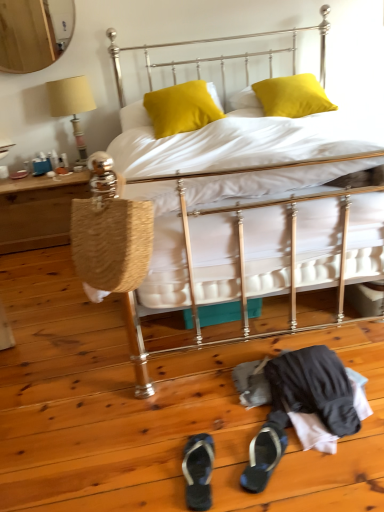
Where is `empty space that is ontop of woven wood table at left (from a real-world perspective)`? This screenshot has height=512, width=384. empty space that is ontop of woven wood table at left (from a real-world perspective) is located at coordinates (34, 177).